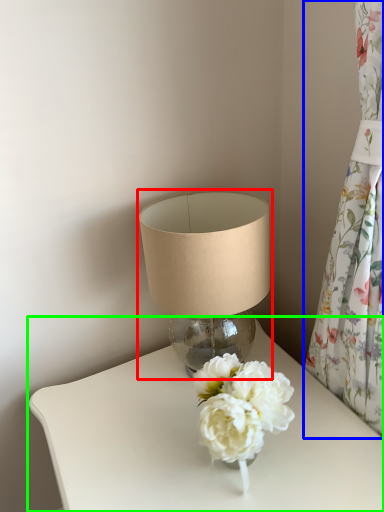
Question: Estimate the real-world distances between objects in this image. Which object is farther from lamp (highlighted by a red box), curtain (highlighted by a blue box) or table (highlighted by a green box)?

Choices:
 (A) curtain
 (B) table

Answer: (A)